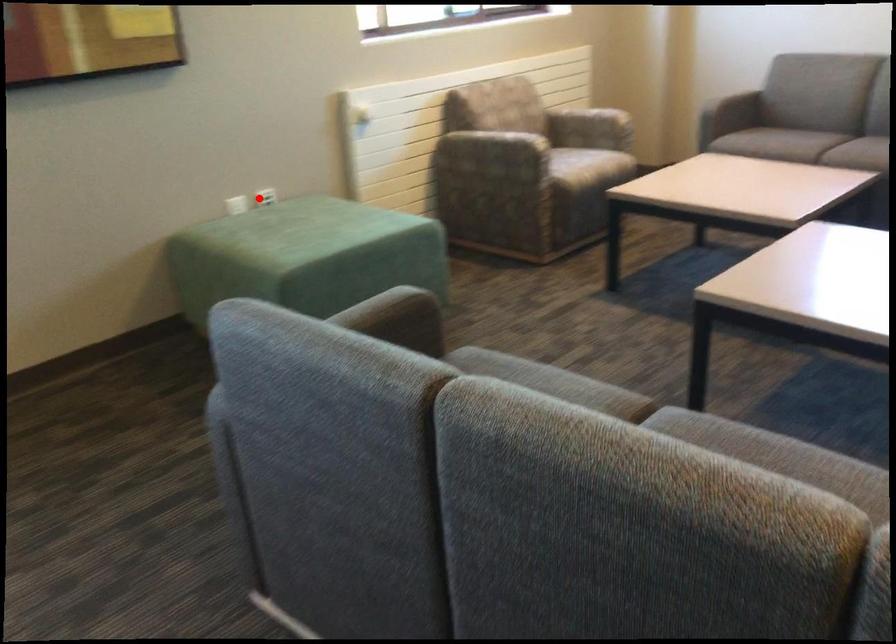
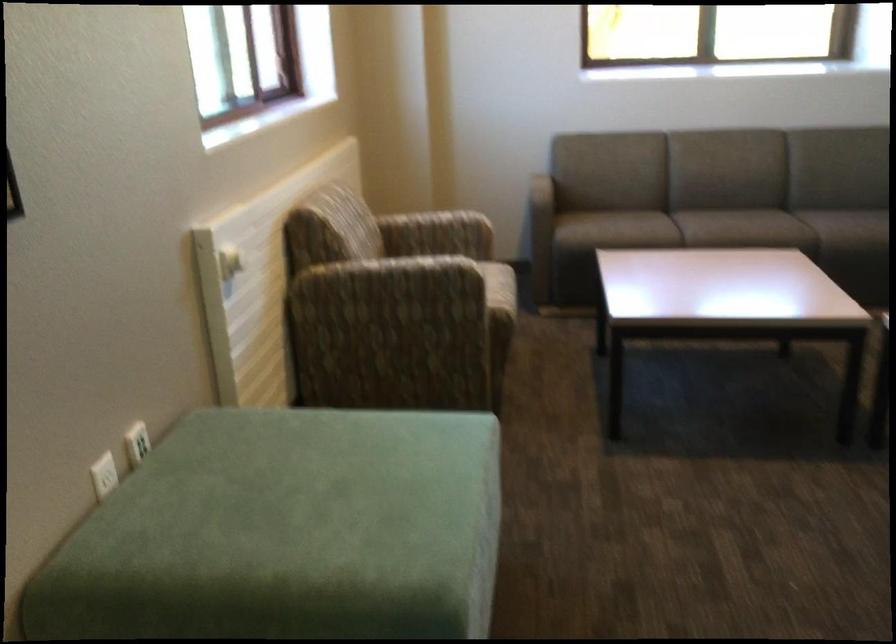
Question: I am providing you with two images of the same scene from different viewpoints. A red point is shown in image1. For the corresponding object point in image2, is it positioned nearer or farther from the camera?

Choices:
 (A) Nearer
 (B) Farther

Answer: (A)